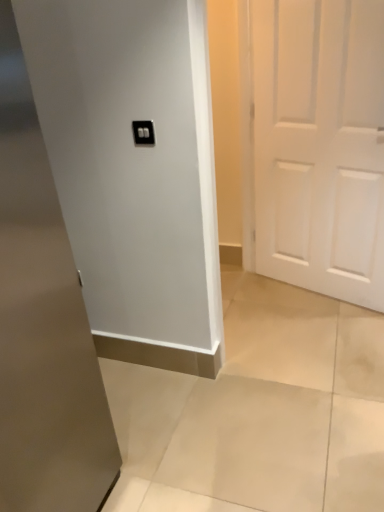
The width and height of the screenshot is (384, 512). I want to click on vacant area in front of white matte door at right, acting as the first door starting from the back, so click(x=316, y=339).